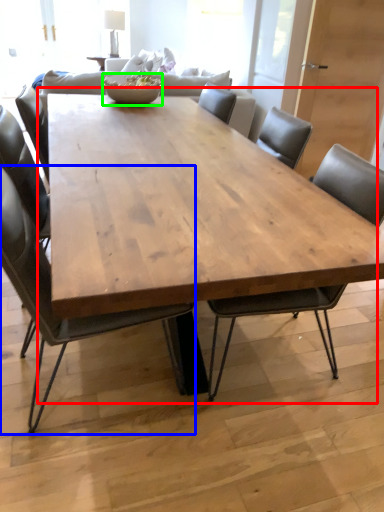
Question: Which is farther away from coffee table (highlighted by a red box)? chair (highlighted by a blue box) or bowl (highlighted by a green box)?

Choices:
 (A) chair
 (B) bowl

Answer: (B)